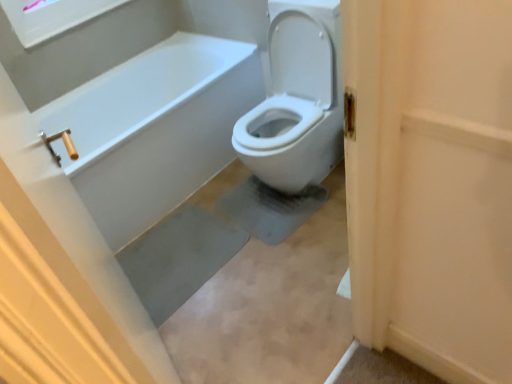
Question: From the image's perspective, relative to white glossy toilet at center, is white matte screen door at upper right above or below?

Choices:
 (A) below
 (B) above

Answer: (A)

Question: Considering the positions of white matte screen door at upper right and white glossy toilet at center in the image, is white matte screen door at upper right bigger or smaller than white glossy toilet at center?

Choices:
 (A) big
 (B) small

Answer: (B)

Question: In the image, is white matte screen door at upper right positioned in front of or behind white glossy toilet at center?

Choices:
 (A) front
 (B) behind

Answer: (A)

Question: From a real-world perspective, is white glossy toilet at center physically located above or below white matte screen door at upper right?

Choices:
 (A) below
 (B) above

Answer: (A)

Question: In terms of size, does white glossy toilet at center appear bigger or smaller than white matte screen door at upper right?

Choices:
 (A) big
 (B) small

Answer: (A)

Question: Based on their positions, is white glossy toilet at center located to the left or right of white matte screen door at upper right?

Choices:
 (A) left
 (B) right

Answer: (A)

Question: Is point (330, 3) closer or farther from the camera than point (406, 36)?

Choices:
 (A) closer
 (B) farther

Answer: (B)